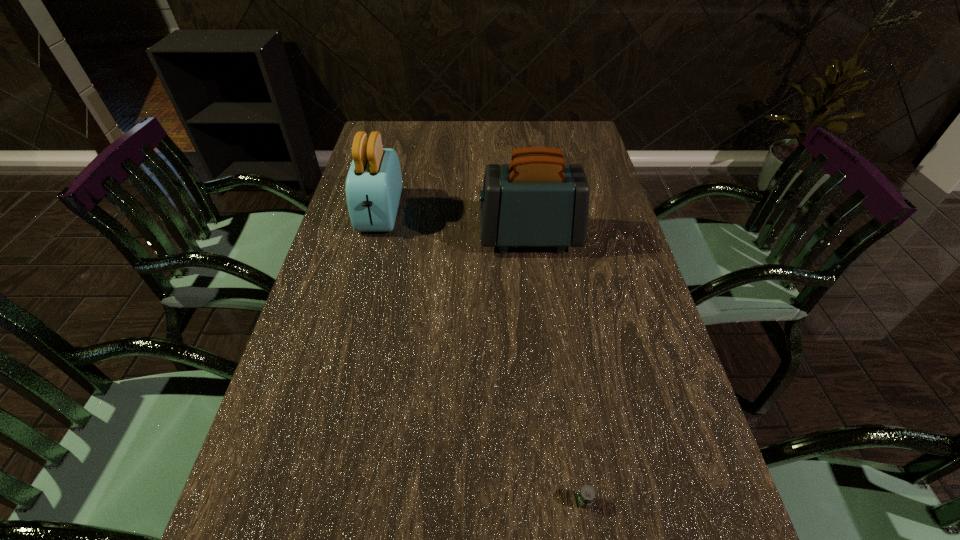
This screenshot has width=960, height=540. Find the location of `empty space between the leftmost object and the right toaster`. empty space between the leftmost object and the right toaster is located at coordinates (455, 225).

Where is `vacant area that lies between the shortest object and the left toaster`? The width and height of the screenshot is (960, 540). vacant area that lies between the shortest object and the left toaster is located at coordinates (482, 357).

Where is `vacant space that is in between the beer can and the right toaster`? vacant space that is in between the beer can and the right toaster is located at coordinates (557, 369).

Identify the location of unoccupied area between the right toaster and the left toaster. (455, 225).

The image size is (960, 540). In order to click on empty space that is in between the left toaster and the nearest object in this screenshot , I will do `click(482, 357)`.

Locate an element on the screen. blank region between the leftmost object and the shortest object is located at coordinates (482, 357).

Identify which object is the second closest to the left toaster. Please provide its 2D coordinates. Your answer should be formatted as a tuple, i.e. [(x, y)], where the tuple contains the x and y coordinates of a point satisfying the conditions above.

[(586, 495)]

The image size is (960, 540). Identify the location of object that can be found as the closest to the right toaster. (374, 182).

At what (x,y) coordinates should I click in order to perform the action: click on vacant space that satisfies the following two spatial constraints: 1. on the front-facing side of the beer can; 2. on the left side of the right toaster. Please return your answer as a coordinate pair (x, y). The height and width of the screenshot is (540, 960). Looking at the image, I should click on (561, 501).

Find the location of `vacant area that satisfies the following two spatial constraints: 1. on the front-facing side of the beer can; 2. on the left side of the right toaster`. vacant area that satisfies the following two spatial constraints: 1. on the front-facing side of the beer can; 2. on the left side of the right toaster is located at coordinates (561, 501).